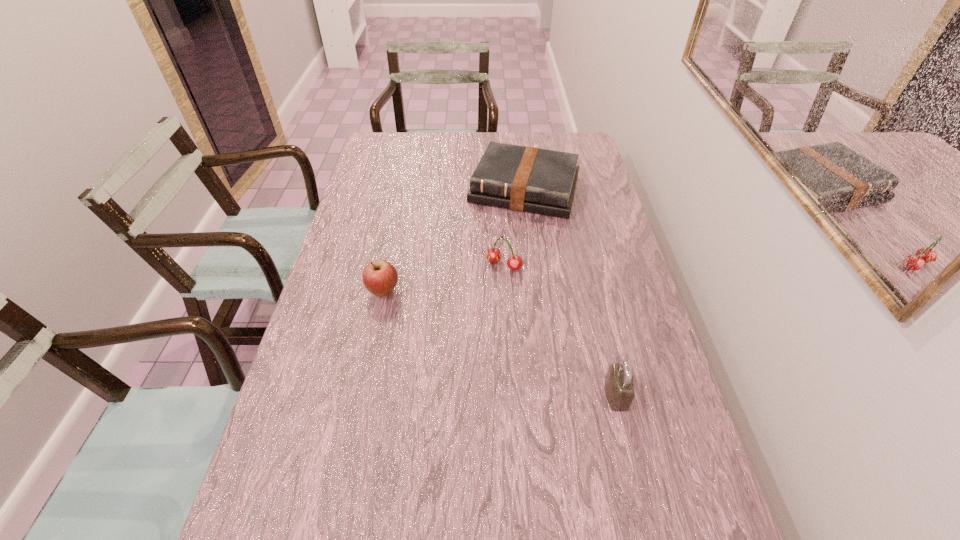
Locate an element on the screen. The image size is (960, 540). free space that is in between the cherry and the farthest object is located at coordinates (515, 227).

Identify the location of vacant space that is in between the leftmost object and the shortest object. Image resolution: width=960 pixels, height=540 pixels. (454, 240).

At what (x,y) coordinates should I click in order to perform the action: click on empty location between the shortest object and the third farthest object. Please return your answer as a coordinate pair (x, y). The height and width of the screenshot is (540, 960). Looking at the image, I should click on (454, 240).

In order to click on vacant point located between the padlock and the leftmost object in this screenshot , I will do `click(500, 343)`.

I want to click on empty space between the hardback book and the cherry, so click(515, 227).

Identify the location of empty space that is in between the padlock and the hardback book. This screenshot has width=960, height=540. (570, 292).

Find the location of a particular element. Image resolution: width=960 pixels, height=540 pixels. object that is the third closest one to the nearest object is located at coordinates (526, 179).

Locate an element on the screen. the closest object to the third farthest object is located at coordinates (493, 255).

The width and height of the screenshot is (960, 540). I want to click on vacant region that satisfies the following two spatial constraints: 1. on the front side of the second nearest object; 2. at the front of the padlock near the keyhole, so click(x=362, y=395).

Identify the location of free space that satisfies the following two spatial constraints: 1. on the front side of the nearest object; 2. at the front of the third farthest object near the keyhole. (362, 395).